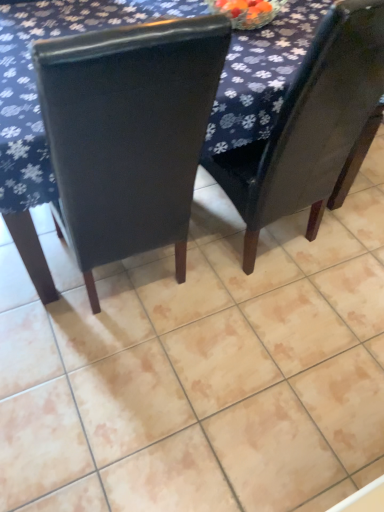
Measure the distance between point (123, 86) and camera.

34.37 inches.

This screenshot has width=384, height=512. Find the location of `matte black chair at center, acting as the 2th chair starting from the right`. matte black chair at center, acting as the 2th chair starting from the right is located at coordinates (128, 134).

Would you say matte black chair at center, acting as the 1th chair starting from the right, is outside matte black chair at center, which appears as the 1th chair when viewed from the left?

Yes, matte black chair at center, acting as the 1th chair starting from the right, is located beyond the bounds of matte black chair at center, which appears as the 1th chair when viewed from the left.

Does matte black chair at center, acting as the 1th chair starting from the right, have a greater height compared to matte black chair at center, which appears as the 1th chair when viewed from the left?

Correct, matte black chair at center, acting as the 1th chair starting from the right, is much taller as matte black chair at center, which appears as the 1th chair when viewed from the left.

Can you confirm if matte black chair at center, acting as the 1th chair starting from the right, is wider than matte black chair at center, acting as the 2th chair starting from the right?

In fact, matte black chair at center, acting as the 1th chair starting from the right, might be narrower than matte black chair at center, acting as the 2th chair starting from the right.

Locate an element on the screen. chair located on the right of matte black chair at center, which appears as the 1th chair when viewed from the left is located at coordinates (313, 128).

From the image's perspective, is dark blue fabric at upper center above matte black chair at center, acting as the 1th chair starting from the right?

Yes.

Is dark blue fabric at upper center not close to matte black chair at center, which ranks as the second chair in left-to-right order?

No, dark blue fabric at upper center is not far away from matte black chair at center, which ranks as the second chair in left-to-right order.

What's the angular difference between dark blue fabric at upper center and matte black chair at center, acting as the 1th chair starting from the right,'s facing directions?

There is a 83.9-degree angle between the facing directions of dark blue fabric at upper center and matte black chair at center, acting as the 1th chair starting from the right.

Considering the relative sizes of matte black chair at center, which appears as the 1th chair when viewed from the left, and dark blue fabric at upper center in the image provided, is matte black chair at center, which appears as the 1th chair when viewed from the left, smaller than dark blue fabric at upper center?

Yes.

Between matte black chair at center, acting as the 2th chair starting from the right, and dark blue fabric at upper center, which one is positioned in front?

matte black chair at center, acting as the 2th chair starting from the right.

From a real-world perspective, relative to dark blue fabric at upper center, is matte black chair at center, acting as the 2th chair starting from the right, vertically above or below?

Clearly, from a real-world perspective, matte black chair at center, acting as the 2th chair starting from the right, is above dark blue fabric at upper center.

Consider the image. Is matte black chair at center, acting as the 2th chair starting from the right, next to dark blue fabric at upper center?

There is a gap between matte black chair at center, acting as the 2th chair starting from the right, and dark blue fabric at upper center.

In the scene shown: How far apart are dark blue fabric at upper center and matte black chair at center, acting as the 2th chair starting from the right?

dark blue fabric at upper center is 13.69 inches from matte black chair at center, acting as the 2th chair starting from the right.

Does dark blue fabric at upper center appear on the right side of matte black chair at center, acting as the 2th chair starting from the right?

Yes.

Is dark blue fabric at upper center looking in the opposite direction of matte black chair at center, acting as the 2th chair starting from the right?

No, dark blue fabric at upper center's orientation is not away from matte black chair at center, acting as the 2th chair starting from the right.

Would you say dark blue fabric at upper center is inside or outside matte black chair at center, which appears as the 1th chair when viewed from the left?

dark blue fabric at upper center is outside matte black chair at center, which appears as the 1th chair when viewed from the left.

From the picture: Would you consider matte black chair at center, which appears as the 1th chair when viewed from the left, to be distant from matte black chair at center, acting as the 1th chair starting from the right?

No, there isn't a large distance between matte black chair at center, which appears as the 1th chair when viewed from the left, and matte black chair at center, acting as the 1th chair starting from the right.

From the image's perspective, does matte black chair at center, acting as the 2th chair starting from the right, appear lower than matte black chair at center, acting as the 1th chair starting from the right?

Yes, from the image's perspective, matte black chair at center, acting as the 2th chair starting from the right, is beneath matte black chair at center, acting as the 1th chair starting from the right.

Locate an element on the screen. This screenshot has height=512, width=384. chair in front of the matte black chair at center, which ranks as the second chair in left-to-right order is located at coordinates (128, 134).

Which of these two, matte black chair at center, acting as the 2th chair starting from the right, or matte black chair at center, which ranks as the second chair in left-to-right order, is smaller?

matte black chair at center, which ranks as the second chair in left-to-right order.

Which of these two, matte black chair at center, acting as the 1th chair starting from the right, or dark blue fabric at upper center, is wider?

dark blue fabric at upper center is wider.

Is point (340, 68) farther from viewer compared to point (258, 37)?

No, it is in front of (258, 37).

Consider the image. Could you measure the distance between matte black chair at center, acting as the 1th chair starting from the right, and dark blue fabric at upper center?

matte black chair at center, acting as the 1th chair starting from the right, is 13.86 inches from dark blue fabric at upper center.

From a real-world perspective, between matte black chair at center, which ranks as the second chair in left-to-right order, and dark blue fabric at upper center, who is vertically lower?

dark blue fabric at upper center.

Identify the location of chair on the right side of matte black chair at center, acting as the 2th chair starting from the right. (313, 128).

Starting from the dark blue fabric at upper center, which chair is the 1st one in front? Please provide its 2D coordinates.

[(313, 128)]

Based on their spatial positions, is matte black chair at center, acting as the 2th chair starting from the right, or dark blue fabric at upper center further from matte black chair at center, acting as the 1th chair starting from the right?

The object further to matte black chair at center, acting as the 1th chair starting from the right, is matte black chair at center, acting as the 2th chair starting from the right.

From the image, which object appears to be nearer to matte black chair at center, acting as the 2th chair starting from the right, matte black chair at center, acting as the 1th chair starting from the right, or dark blue fabric at upper center?

dark blue fabric at upper center is positioned closer to the anchor matte black chair at center, acting as the 2th chair starting from the right.

From the image, which object appears to be nearer to matte black chair at center, acting as the 2th chair starting from the right, dark blue fabric at upper center or matte black chair at center, acting as the 1th chair starting from the right?

Among the two, dark blue fabric at upper center is located nearer to matte black chair at center, acting as the 2th chair starting from the right.

From the image, which object appears to be nearer to dark blue fabric at upper center, matte black chair at center, which appears as the 1th chair when viewed from the left, or matte black chair at center, acting as the 1th chair starting from the right?

Among the two, matte black chair at center, which appears as the 1th chair when viewed from the left, is located nearer to dark blue fabric at upper center.

From the picture: From the image, which object appears to be nearer to dark blue fabric at upper center, matte black chair at center, which ranks as the second chair in left-to-right order, or matte black chair at center, acting as the 2th chair starting from the right?

matte black chair at center, acting as the 2th chair starting from the right, is closer to dark blue fabric at upper center.

From the image, which object appears to be nearer to matte black chair at center, acting as the 1th chair starting from the right, dark blue fabric at upper center or matte black chair at center, acting as the 2th chair starting from the right?

The object closer to matte black chair at center, acting as the 1th chair starting from the right, is dark blue fabric at upper center.

Where is `tablecloth situated between matte black chair at center, acting as the 2th chair starting from the right, and matte black chair at center, acting as the 1th chair starting from the right, from left to right`? This screenshot has height=512, width=384. tablecloth situated between matte black chair at center, acting as the 2th chair starting from the right, and matte black chair at center, acting as the 1th chair starting from the right, from left to right is located at coordinates (35, 81).